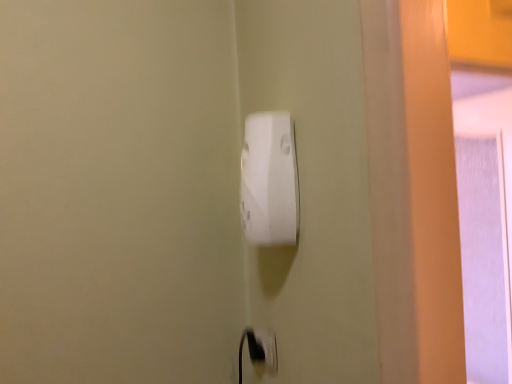
Question: Which direction should I rotate to look at white plastic electric outlet at lower center?

Choices:
 (A) left
 (B) right

Answer: (B)

Question: Can you confirm if white plastic socket at center is bigger than white plastic electric outlet at lower center?

Choices:
 (A) no
 (B) yes

Answer: (B)

Question: Does white plastic socket at center appear on the left side of white plastic electric outlet at lower center?

Choices:
 (A) yes
 (B) no

Answer: (A)

Question: Is white plastic socket at center shorter than white plastic electric outlet at lower center?

Choices:
 (A) no
 (B) yes

Answer: (A)

Question: From a real-world perspective, does white plastic socket at center stand above white plastic electric outlet at lower center?

Choices:
 (A) yes
 (B) no

Answer: (A)

Question: Is white plastic socket at center not within white plastic electric outlet at lower center?

Choices:
 (A) no
 (B) yes

Answer: (B)

Question: Is white plastic socket at center turned away from white plastic electric outlet at lower center?

Choices:
 (A) no
 (B) yes

Answer: (A)

Question: Are white plastic electric outlet at lower center and white plastic socket at center making contact?

Choices:
 (A) no
 (B) yes

Answer: (A)

Question: From the image's perspective, is white plastic electric outlet at lower center above white plastic socket at center?

Choices:
 (A) no
 (B) yes

Answer: (A)

Question: Does white plastic electric outlet at lower center have a larger size compared to white plastic socket at center?

Choices:
 (A) yes
 (B) no

Answer: (B)

Question: Is white plastic electric outlet at lower center behind white plastic socket at center?

Choices:
 (A) yes
 (B) no

Answer: (A)

Question: Can you confirm if white plastic electric outlet at lower center is wider than white plastic socket at center?

Choices:
 (A) no
 (B) yes

Answer: (A)

Question: From a real-world perspective, is white plastic electric outlet at lower center beneath white plastic socket at center?

Choices:
 (A) no
 (B) yes

Answer: (B)

Question: In terms of height, does white plastic socket at center look taller or shorter compared to white plastic electric outlet at lower center?

Choices:
 (A) short
 (B) tall

Answer: (B)